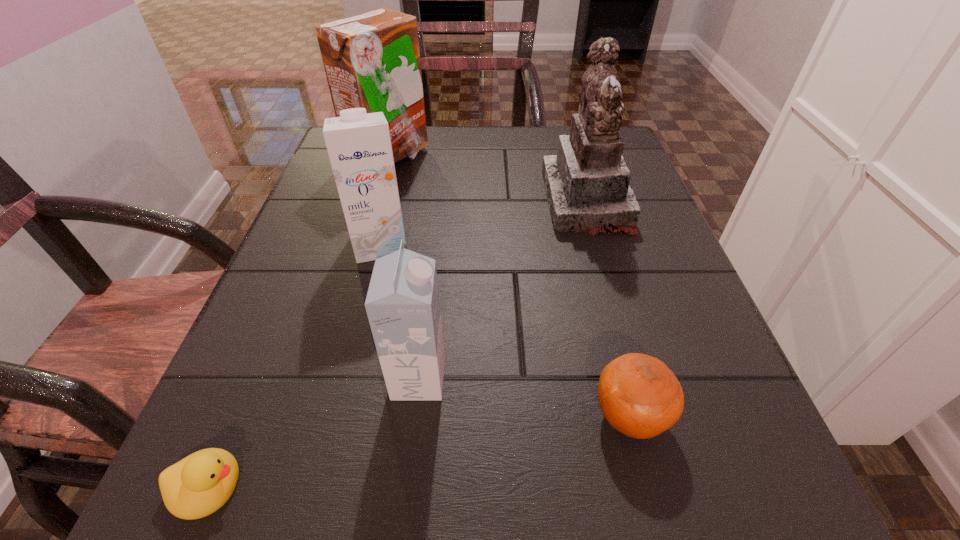
Image resolution: width=960 pixels, height=540 pixels. Find the location of `vacant region located 0.330m on the front-facing side of the figurine`. vacant region located 0.330m on the front-facing side of the figurine is located at coordinates (383, 201).

Where is `vacant space positioned 0.230m on the straw side of the farthest carton`? vacant space positioned 0.230m on the straw side of the farthest carton is located at coordinates (527, 156).

Locate an element on the screen. free spot located 0.220m on the front of the second nearest carton is located at coordinates (348, 373).

Locate an element on the screen. free location located on the front label of the rightmost carton is located at coordinates (663, 379).

Where is `vacant area situated 0.320m on the back of the orange`? This screenshot has width=960, height=540. vacant area situated 0.320m on the back of the orange is located at coordinates (583, 234).

Locate an element on the screen. free location located 0.380m on the face of the nearest object is located at coordinates (x=577, y=487).

Locate an element on the screen. The height and width of the screenshot is (540, 960). figurine that is at the far edge is located at coordinates (587, 186).

The height and width of the screenshot is (540, 960). Find the location of `carton that is at the far edge`. carton that is at the far edge is located at coordinates (372, 60).

Image resolution: width=960 pixels, height=540 pixels. Identify the location of object present at the near edge. (198, 485).

Where is `duckling present at the left edge`? duckling present at the left edge is located at coordinates (198, 485).